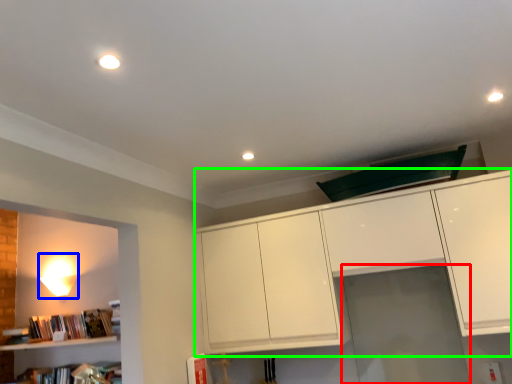
Question: Based on their relative distances, which object is farther from glass door (highlighted by a red box)? Choose from lamp (highlighted by a blue box) and cabinetry (highlighted by a green box).

Choices:
 (A) lamp
 (B) cabinetry

Answer: (A)